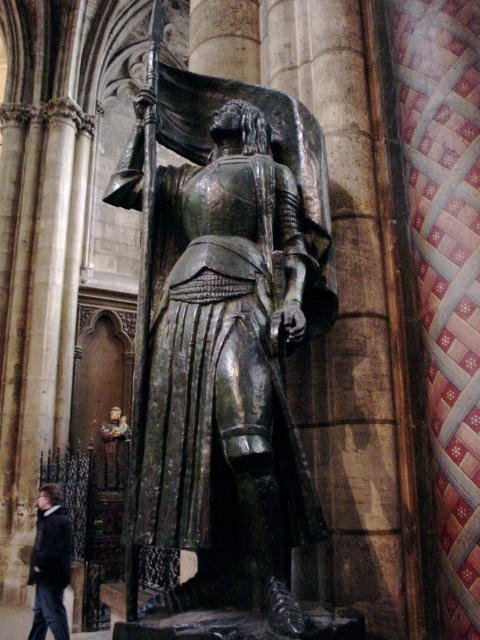
Question: In this image, where is bronze statue at center located relative to dark gray wool coat at lower left?

Choices:
 (A) below
 (B) above

Answer: (B)

Question: Can you confirm if bronze statue at center is smaller than dark gray wool coat at lower left?

Choices:
 (A) no
 (B) yes

Answer: (B)

Question: Can you confirm if bronze statue at center is bigger than dark gray wool coat at lower left?

Choices:
 (A) no
 (B) yes

Answer: (A)

Question: Which object appears farthest from the camera in this image?

Choices:
 (A) bronze statue at center
 (B) dark gray wool coat at lower left

Answer: (B)